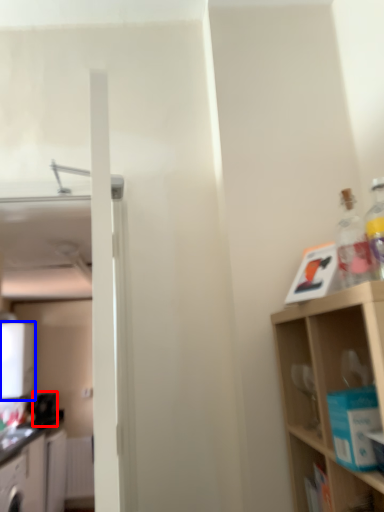
Question: Which object appears farthest to the camera in this image, appliance (highlighted by a red box) or appliance (highlighted by a blue box)?

Choices:
 (A) appliance
 (B) appliance

Answer: (A)